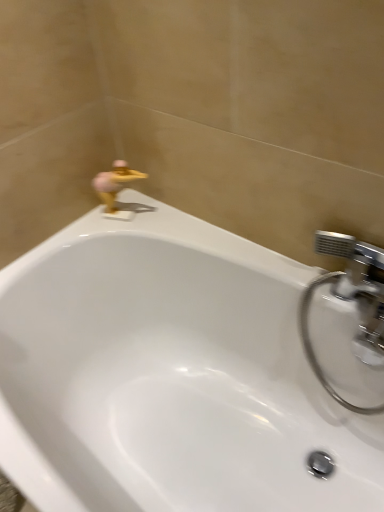
Identify the location of chrome metallic faucet at upper right. coord(349,300).

Is white glossy bathtub at upper center facing towards gold metallic duck at upper left?

No, white glossy bathtub at upper center is not facing towards gold metallic duck at upper left.

Between white glossy bathtub at upper center and gold metallic duck at upper left, which one appears on the left side from the viewer's perspective?

gold metallic duck at upper left is more to the left.

Locate an element on the screen. This screenshot has width=384, height=512. bathtub in front of the gold metallic duck at upper left is located at coordinates (169, 375).

Based on the photo, is chrome metallic faucet at upper right spatially inside white glossy bathtub at upper center, or outside of it?

chrome metallic faucet at upper right lies within the bounds of white glossy bathtub at upper center.

The image size is (384, 512). What are the coordinates of `bathtub on the left of the chrome metallic faucet at upper right` in the screenshot? It's located at (169, 375).

Considering the relative sizes of chrome metallic faucet at upper right and white glossy bathtub at upper center in the image provided, is chrome metallic faucet at upper right shorter than white glossy bathtub at upper center?

Correct, chrome metallic faucet at upper right is not as tall as white glossy bathtub at upper center.

Which of these two, chrome metallic faucet at upper right or white glossy bathtub at upper center, is bigger?

With larger size is white glossy bathtub at upper center.

From a real-world perspective, which is physically above, gold metallic duck at upper left or chrome metallic faucet at upper right?

In real-world perspective, gold metallic duck at upper left is above.

Is gold metallic duck at upper left not close to chrome metallic faucet at upper right?

No, there isn't a large distance between gold metallic duck at upper left and chrome metallic faucet at upper right.

Which is closer to the camera, (99, 193) or (367, 323)?

Positioned in front is point (367, 323).

Does gold metallic duck at upper left have a greater height compared to chrome metallic faucet at upper right?

Incorrect, the height of gold metallic duck at upper left is not larger of that of chrome metallic faucet at upper right.

Is white glossy bathtub at upper center not within chrome metallic faucet at upper right?

white glossy bathtub at upper center is positioned outside chrome metallic faucet at upper right.

From the image's perspective, who appears lower, white glossy bathtub at upper center or chrome metallic faucet at upper right?

From the image's view, white glossy bathtub at upper center is below.

Which point is more distant from viewer, (326, 399) or (308, 294)?

The point (326, 399) is behind.

At what (x,y) coordinates should I click in order to perform the action: click on bathtub beneath the chrome metallic faucet at upper right (from a real-world perspective). Please return your answer as a coordinate pair (x, y). The image size is (384, 512). Looking at the image, I should click on (169, 375).

From the picture: Considering the sizes of objects gold metallic duck at upper left and white glossy bathtub at upper center in the image provided, who is shorter, gold metallic duck at upper left or white glossy bathtub at upper center?

With less height is gold metallic duck at upper left.

Which is in front, gold metallic duck at upper left or white glossy bathtub at upper center?

white glossy bathtub at upper center is more forward.

How different are the orientations of gold metallic duck at upper left and white glossy bathtub at upper center in degrees?

The angular difference between gold metallic duck at upper left and white glossy bathtub at upper center is 27.3 degrees.

Is there a large distance between chrome metallic faucet at upper right and gold metallic duck at upper left?

No, chrome metallic faucet at upper right is not far from gold metallic duck at upper left.

Would you say chrome metallic faucet at upper right is inside or outside gold metallic duck at upper left?

chrome metallic faucet at upper right is outside gold metallic duck at upper left.

Is chrome metallic faucet at upper right bigger than gold metallic duck at upper left?

Indeed, chrome metallic faucet at upper right has a larger size compared to gold metallic duck at upper left.

From the image's perspective, is chrome metallic faucet at upper right located above or below gold metallic duck at upper left?

From the image's perspective, chrome metallic faucet at upper right appears below gold metallic duck at upper left.

Locate an element on the screen. Image resolution: width=384 pixels, height=512 pixels. plumbing fixture above the white glossy bathtub at upper center (from a real-world perspective) is located at coordinates (114, 183).

Find the location of a particular element. The width and height of the screenshot is (384, 512). tap on the right side of white glossy bathtub at upper center is located at coordinates pos(349,300).

Considering their positions, is gold metallic duck at upper left positioned further to white glossy bathtub at upper center than chrome metallic faucet at upper right?

gold metallic duck at upper left is further to white glossy bathtub at upper center.

Which object lies further to the anchor point chrome metallic faucet at upper right, gold metallic duck at upper left or white glossy bathtub at upper center?

gold metallic duck at upper left lies further to chrome metallic faucet at upper right than the other object.

From the image, which object appears to be farther from white glossy bathtub at upper center, chrome metallic faucet at upper right or gold metallic duck at upper left?

gold metallic duck at upper left.

Based on their spatial positions, is white glossy bathtub at upper center or chrome metallic faucet at upper right closer to gold metallic duck at upper left?

white glossy bathtub at upper center is positioned closer to the anchor gold metallic duck at upper left.

Considering their positions, is chrome metallic faucet at upper right positioned closer to gold metallic duck at upper left than white glossy bathtub at upper center?

white glossy bathtub at upper center is closer to gold metallic duck at upper left.

Looking at the image, which one is located further to chrome metallic faucet at upper right, white glossy bathtub at upper center or gold metallic duck at upper left?

Among the two, gold metallic duck at upper left is located further to chrome metallic faucet at upper right.

Where is `tap between white glossy bathtub at upper center and gold metallic duck at upper left in the front-back direction`? This screenshot has width=384, height=512. tap between white glossy bathtub at upper center and gold metallic duck at upper left in the front-back direction is located at coordinates (349, 300).